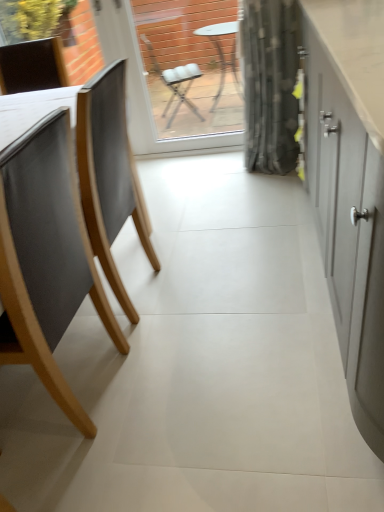
The width and height of the screenshot is (384, 512). In order to click on vacant space situated on the left part of matte wood chair at left in this screenshot , I will do `click(27, 420)`.